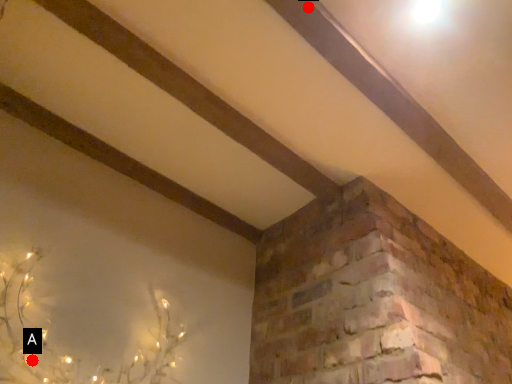
Question: Two points are circled on the image, labeled by A and B beside each circle. Which of the following is the farthest from the observer?

Choices:
 (A) A is further
 (B) B is further

Answer: (A)